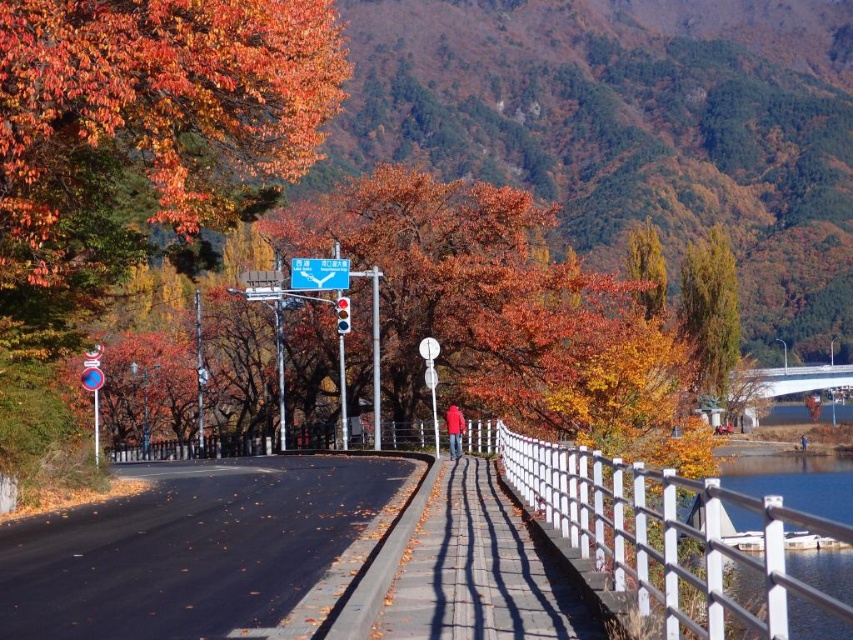
Which is below, green leafy tree at upper right or yellow-green leafy tree at upper right?

Positioned lower is yellow-green leafy tree at upper right.

Can you confirm if green leafy tree at upper right is bigger than yellow-green leafy tree at upper right?

No.

Does point (686, 321) come behind point (640, 262)?

No, it is in front of (640, 262).

Locate an element on the screen. green leafy tree at upper right is located at coordinates (711, 310).

Based on the photo, who is higher up, green leafy tree at upper right or blue plastic sign at center?

green leafy tree at upper right is above.

Identify the location of green leafy tree at upper right. The width and height of the screenshot is (853, 640). [x=711, y=310].

Does smooth glass water at right appear under white concrete bridge at right?

Yes, smooth glass water at right is below white concrete bridge at right.

Between smooth glass water at right and white concrete bridge at right, which one has more height?

smooth glass water at right

Between point (817, 586) and point (817, 374), which one is positioned behind?

The point (817, 374) is behind.

The image size is (853, 640). Identify the location of smooth glass water at right. (795, 481).